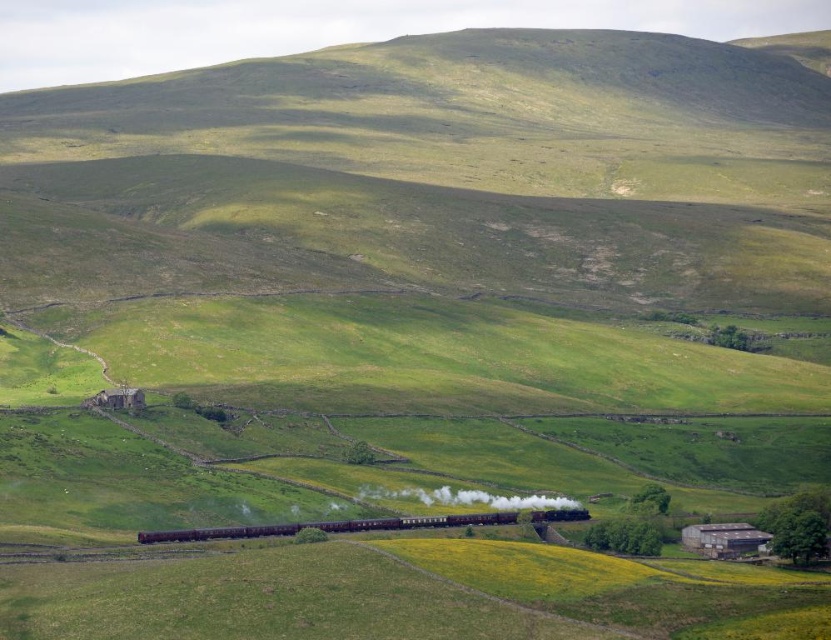
You are a photographer trying to capture the entire train and steam in one frame. Given that your camera can only focus on objects up to 5 meters wide, can you fit both the polished dark brown train at center and the polished dark brown steam at center into the frame?

The polished dark brown train at center is wider than the polished dark brown steam at center. Since the camera can focus on objects up to 5 meters wide, and the train is the wider object, as long as the train is within the 5 meters width limit, both can fit. However, if the combined width of both exceeds 5 meters, they might not. The description only states the train is wider than the steam, but doesn not provide exact measurements. Without specific widths, it is impossible to determine if they fit within

You are a photographer planning to take a photo of the scene. You want to ensure that both the polished dark brown train at center and the polished dark brown steam at center are clearly visible. Based on their positions, which object should you focus on first to capture both in the frame?

The polished dark brown train at center is positioned on the left side of the polished dark brown steam at center. Since the train is closer to the left edge, focusing on it first would allow you to adjust the frame to include both objects without cropping either out.